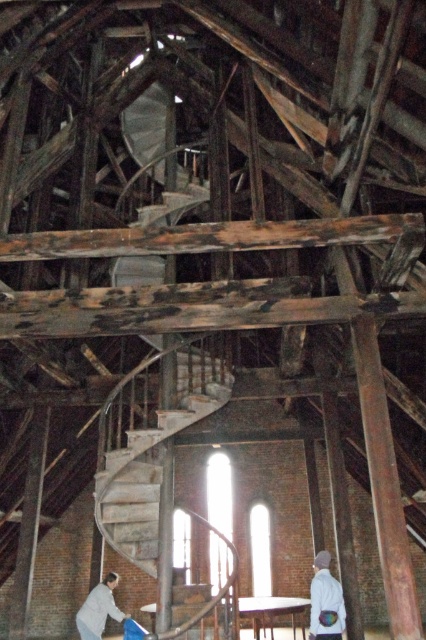
You are standing in the old building and see a white matte jacket at lower right and a light gray fabric at lower left. Which object is positioned higher in the scene?

The white matte jacket at lower right is located above the light gray fabric at lower left, so it is positioned higher in the scene.

You are standing at the entrance of the old building and notice a white matte jacket at lower right. Where exactly is the white matte jacket positioned in relation to the spiral staircase?

The white matte jacket at lower right is located at point coordinates (325,602), which places it near the base of the spiral staircase on the lower right side of the scene.